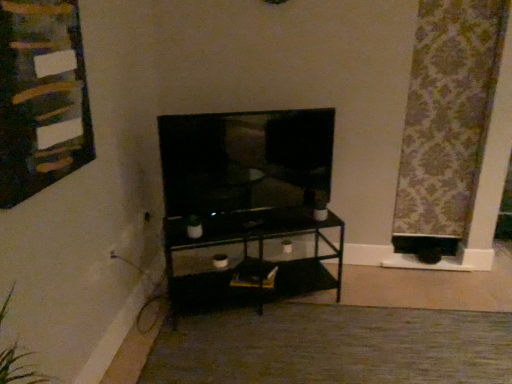
The height and width of the screenshot is (384, 512). Find the location of `vacant region below carpet at center (from a real-world perspective)`. vacant region below carpet at center (from a real-world perspective) is located at coordinates (343, 350).